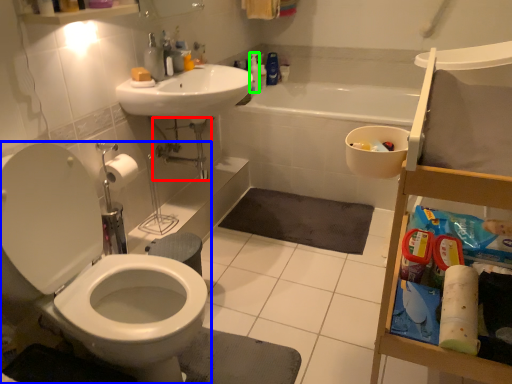
Question: Which object is positioned farthest from plumbing fixture (highlighted by a red box)? Select from toilet (highlighted by a blue box) and cleaning product (highlighted by a green box).

Choices:
 (A) toilet
 (B) cleaning product

Answer: (A)